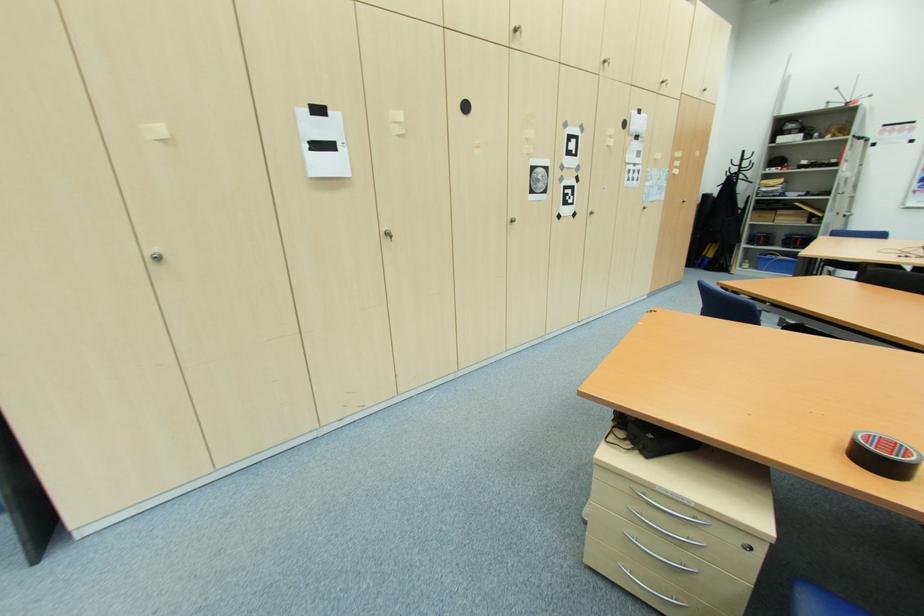
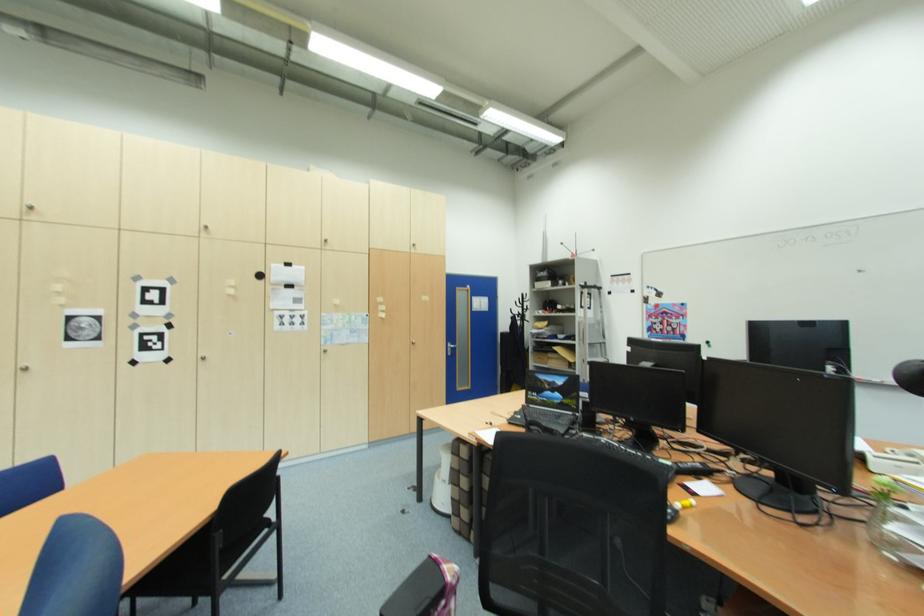
Where in the second image is the point corresponding to point 841,171 from the first image?

(578, 317)